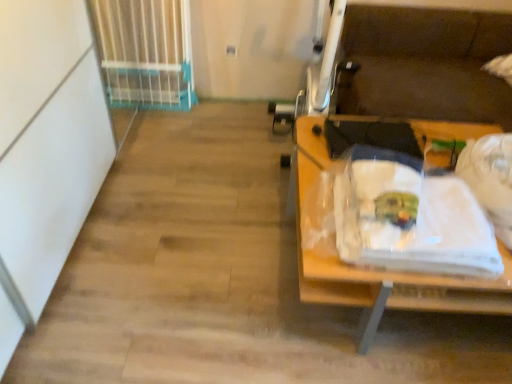
Question: From a real-world perspective, is wooden desk at right on white plastic gate at upper left?

Choices:
 (A) yes
 (B) no

Answer: (B)

Question: Does wooden desk at right have a larger size compared to white plastic gate at upper left?

Choices:
 (A) yes
 (B) no

Answer: (A)

Question: Does wooden desk at right have a smaller size compared to white plastic gate at upper left?

Choices:
 (A) no
 (B) yes

Answer: (A)

Question: Is white plastic gate at upper left at the back of wooden desk at right?

Choices:
 (A) no
 (B) yes

Answer: (A)

Question: From a real-world perspective, is wooden desk at right beneath white plastic gate at upper left?

Choices:
 (A) no
 (B) yes

Answer: (B)

Question: Is point (421, 261) closer or farther from the camera than point (371, 279)?

Choices:
 (A) closer
 (B) farther

Answer: (A)

Question: From the image's perspective, relative to wooden desk at right, is white fabric at right above or below?

Choices:
 (A) below
 (B) above

Answer: (B)

Question: From a real-world perspective, relative to wooden desk at right, is white fabric at right vertically above or below?

Choices:
 (A) above
 (B) below

Answer: (A)

Question: Considering their positions, is white fabric at right located in front of or behind wooden desk at right?

Choices:
 (A) behind
 (B) front

Answer: (B)

Question: From the image's perspective, is white plastic gate at upper left above or below wooden desk at right?

Choices:
 (A) below
 (B) above

Answer: (B)

Question: Is point (122, 74) positioned closer to the camera than point (323, 296)?

Choices:
 (A) closer
 (B) farther

Answer: (B)

Question: In terms of height, does white plastic gate at upper left look taller or shorter compared to wooden desk at right?

Choices:
 (A) tall
 (B) short

Answer: (A)

Question: Is white plastic gate at upper left wider or thinner than wooden desk at right?

Choices:
 (A) wide
 (B) thin

Answer: (B)

Question: From a real-world perspective, relative to white fabric at right, is white plastic gate at upper left vertically above or below?

Choices:
 (A) below
 (B) above

Answer: (A)

Question: Based on their sizes in the image, would you say white plastic gate at upper left is bigger or smaller than white fabric at right?

Choices:
 (A) small
 (B) big

Answer: (B)